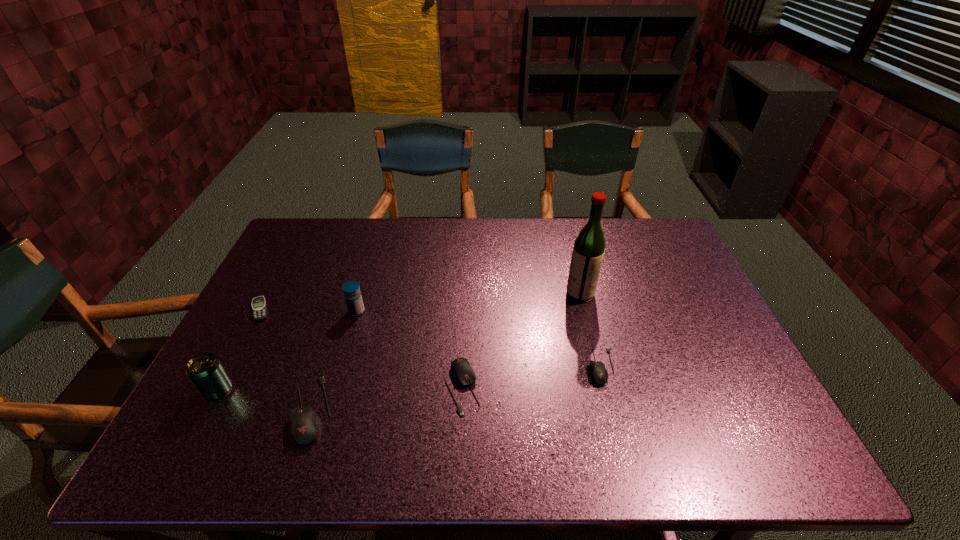
This screenshot has width=960, height=540. Identify the location of beeper present at the left edge. (258, 305).

Find the location of a particular element. object present at the near left corner is located at coordinates (206, 372).

In the image, there is a desktop. At what (x,y) coordinates should I click in order to perform the action: click on vacant space at the far edge. Please return your answer as a coordinate pair (x, y). Looking at the image, I should click on (615, 234).

Where is `free space at the near edge of the desktop`? free space at the near edge of the desktop is located at coordinates (276, 397).

Where is `vacant region at the left edge of the desktop`? vacant region at the left edge of the desktop is located at coordinates (274, 289).

The height and width of the screenshot is (540, 960). Find the location of `free region at the right edge`. free region at the right edge is located at coordinates (728, 368).

Find the location of a particular element. The image size is (960, 540). vacant area at the far left corner is located at coordinates (321, 256).

Where is `vacant space at the far right corner`? vacant space at the far right corner is located at coordinates (647, 254).

The height and width of the screenshot is (540, 960). Find the location of `free point between the liquor and the medicine`. free point between the liquor and the medicine is located at coordinates (468, 302).

Where is `empty space between the second mouse from right to left and the shortest mouse`? The image size is (960, 540). empty space between the second mouse from right to left and the shortest mouse is located at coordinates (532, 377).